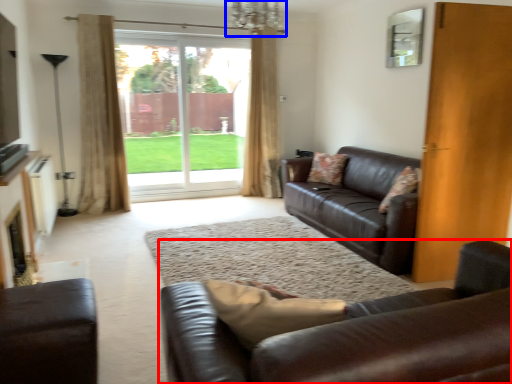
Question: Which point is further to the camera, studio couch (highlighted by a red box) or chandelier (highlighted by a blue box)?

Choices:
 (A) studio couch
 (B) chandelier

Answer: (B)